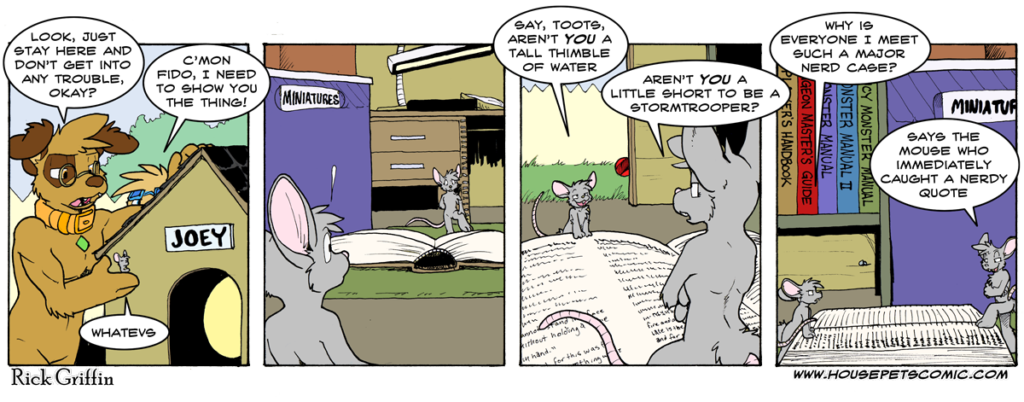
This screenshot has height=402, width=1024. What are the coordinates of `light` in the screenshot? It's located at (421, 54).